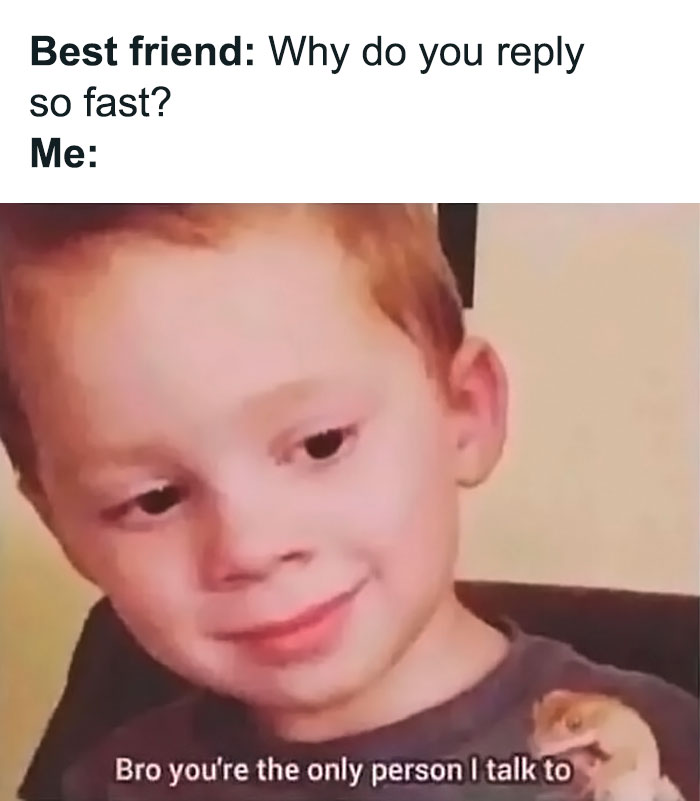
You are a GUI agent. You are given a task and a screenshot of the screen. Output one action in this format:
    pyautogui.click(x=<x>, y=<y>)
    Task: Click on the wall in background
    Image resolution: width=700 pixels, height=801 pixels.
    Given the screenshot: What is the action you would take?
    (x=588, y=380)